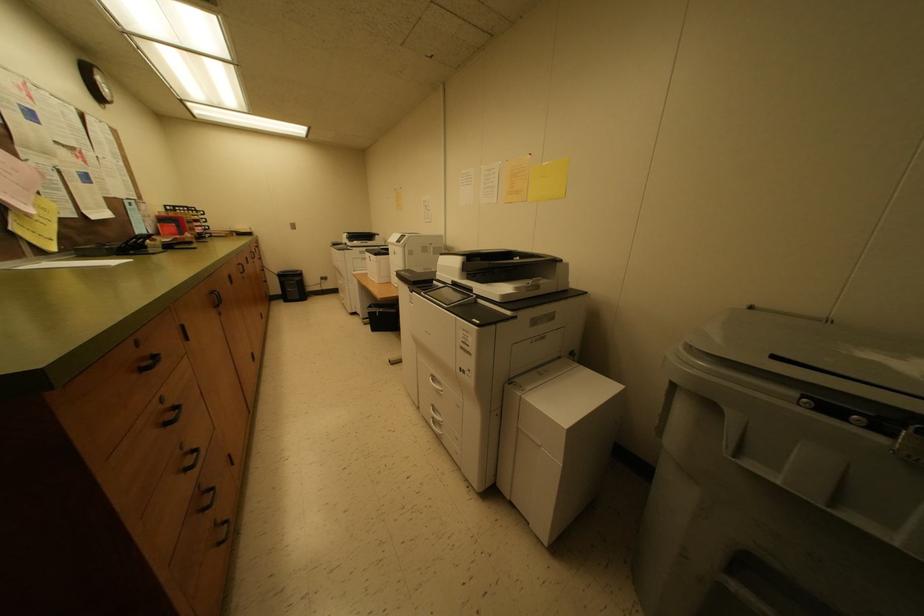
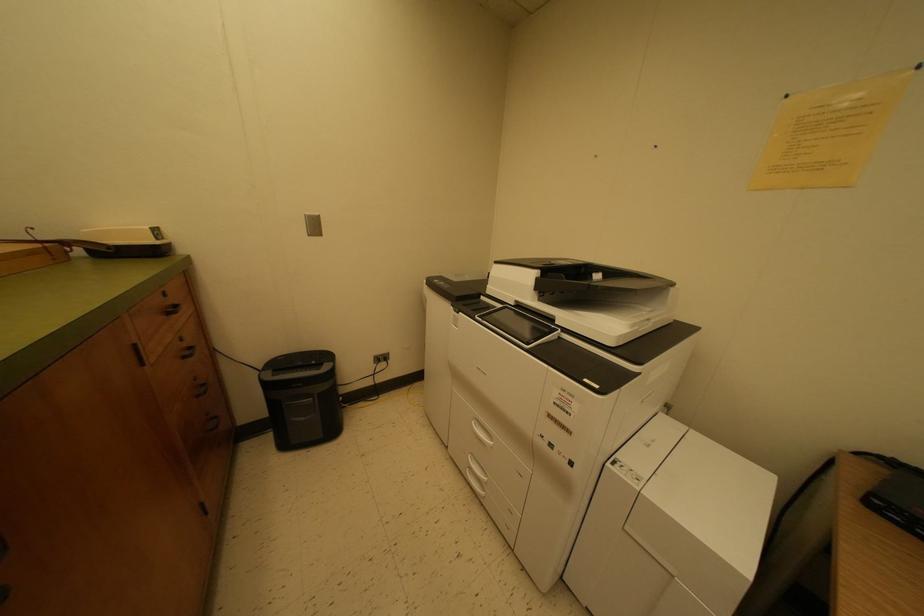
Which direction would the cameraman need to move to produce the second image?

The movement direction of the cameraman is left, forward.